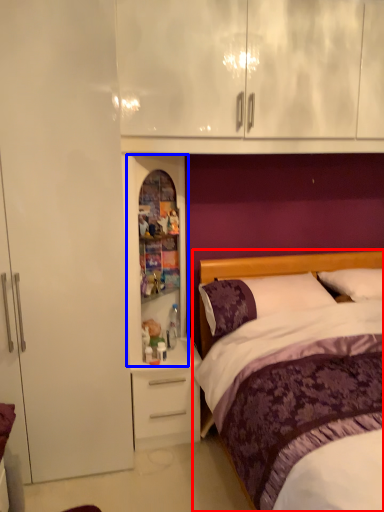
Question: Which object is further to the camera taking this photo, bed (highlighted by a red box) or medicine cabinet (highlighted by a blue box)?

Choices:
 (A) bed
 (B) medicine cabinet

Answer: (B)